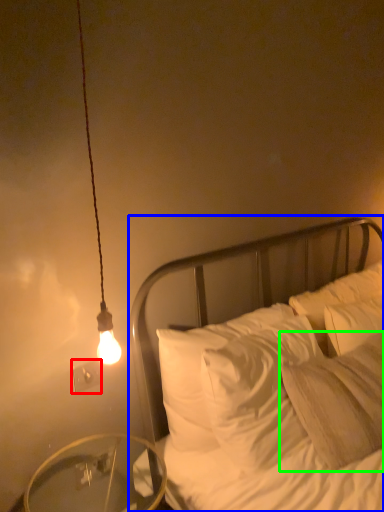
Question: Which is farther away from electric outlet (highlighted by a red box)? bed (highlighted by a blue box) or pillow (highlighted by a green box)?

Choices:
 (A) bed
 (B) pillow

Answer: (B)